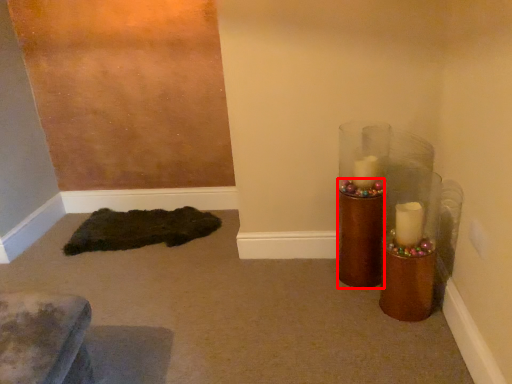
Question: Where is candle holder (annotated by the red box) located in relation to mat in the image?

Choices:
 (A) left
 (B) right

Answer: (B)